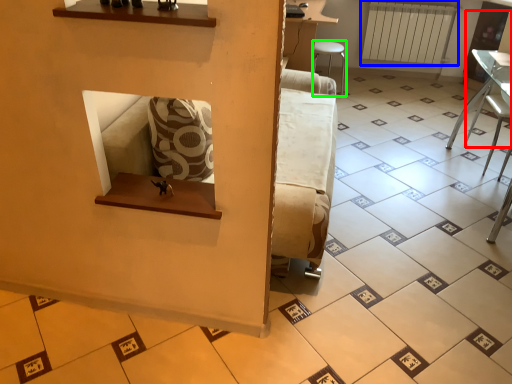
Question: Which object is the farthest from armchair (highlighted by a red box)? Choose among these: radiator (highlighted by a blue box) or furniture (highlighted by a green box).

Choices:
 (A) radiator
 (B) furniture

Answer: (B)